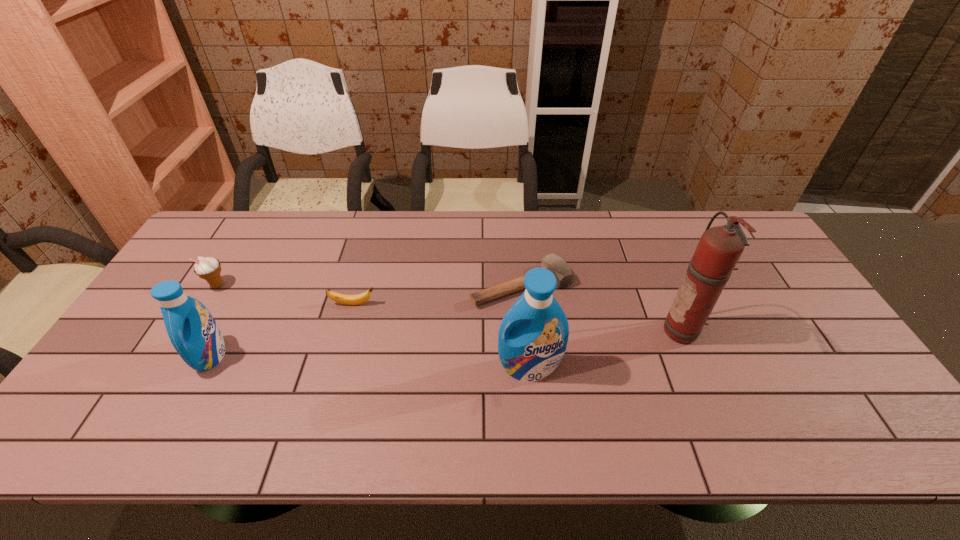
The image size is (960, 540). In order to click on mallet in this screenshot , I will do `click(565, 277)`.

Locate an element on the screen. The width and height of the screenshot is (960, 540). free region located 0.090m on the front-facing side of the shorter detergent is located at coordinates (258, 356).

Image resolution: width=960 pixels, height=540 pixels. Identify the location of vacant space positioned at the stem of the third object from left to right. (467, 304).

Locate an element on the screen. The height and width of the screenshot is (540, 960). blank space located 0.150m on the side of the tallest object with the label and nozzle is located at coordinates (608, 332).

Locate an element on the screen. Image resolution: width=960 pixels, height=540 pixels. free space located on the side of the tallest object with the label and nozzle is located at coordinates (604, 332).

Where is `vacant space located 0.330m on the side of the tallest object with the label and nozzle`? vacant space located 0.330m on the side of the tallest object with the label and nozzle is located at coordinates (541, 332).

At what (x,y) coordinates should I click in order to perform the action: click on free space located 0.250m on the right of the icecream. Please return your answer as a coordinate pair (x, y). Looking at the image, I should click on pos(312,285).

I want to click on free location located 0.250m on the right of the mallet, so click(x=657, y=286).

At what (x,y) coordinates should I click in order to perform the action: click on object located at the left edge. Please return your answer as a coordinate pair (x, y). The height and width of the screenshot is (540, 960). Looking at the image, I should click on (209, 268).

In the image, there is a desktop. Where is `vacant space at the far edge`? vacant space at the far edge is located at coordinates (307, 220).